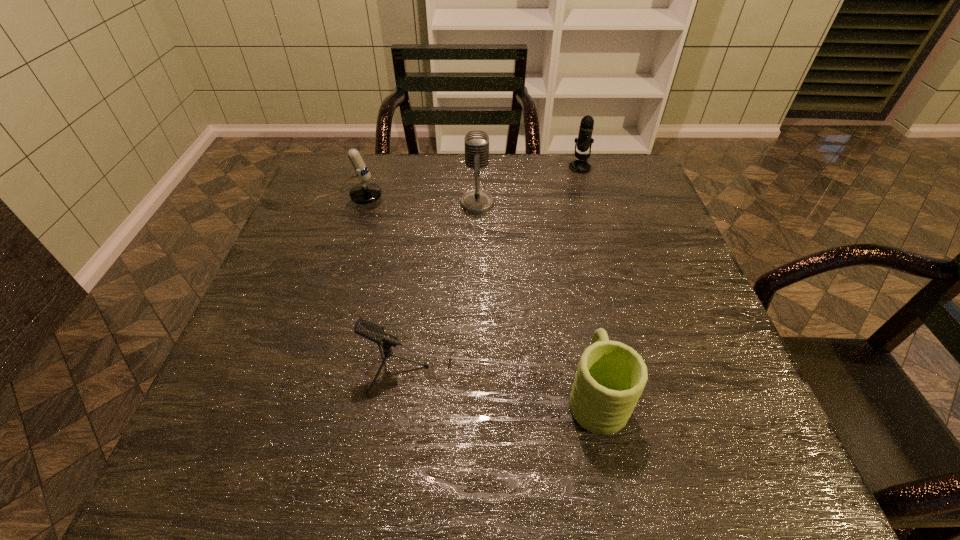
Locate an element on the screen. The image size is (960, 540). free space that satisfies the following two spatial constraints: 1. on the front side of the tallest object; 2. on the stand of the shortest microphone is located at coordinates (476, 369).

Locate an element on the screen. free point that satisfies the following two spatial constraints: 1. on the front side of the tallest microphone; 2. on the stand of the shortest microphone is located at coordinates (476, 369).

You are a GUI agent. You are given a task and a screenshot of the screen. Output one action in this format:
    pyautogui.click(x=<x>, y=<y>)
    Task: Click on the vacant space that satisfies the following two spatial constraints: 1. on the side of the second object from right to left with the handle; 2. on the stand of the nearest microphone
    
    Given the screenshot: What is the action you would take?
    pyautogui.click(x=590, y=369)